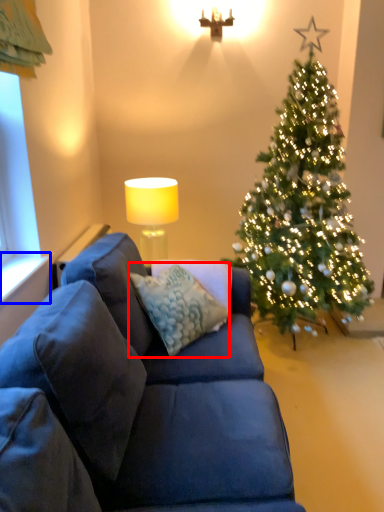
Question: Which object appears closest to the camera in this image, pillow (highlighted by a red box) or window sill (highlighted by a blue box)?

Choices:
 (A) pillow
 (B) window sill

Answer: (B)